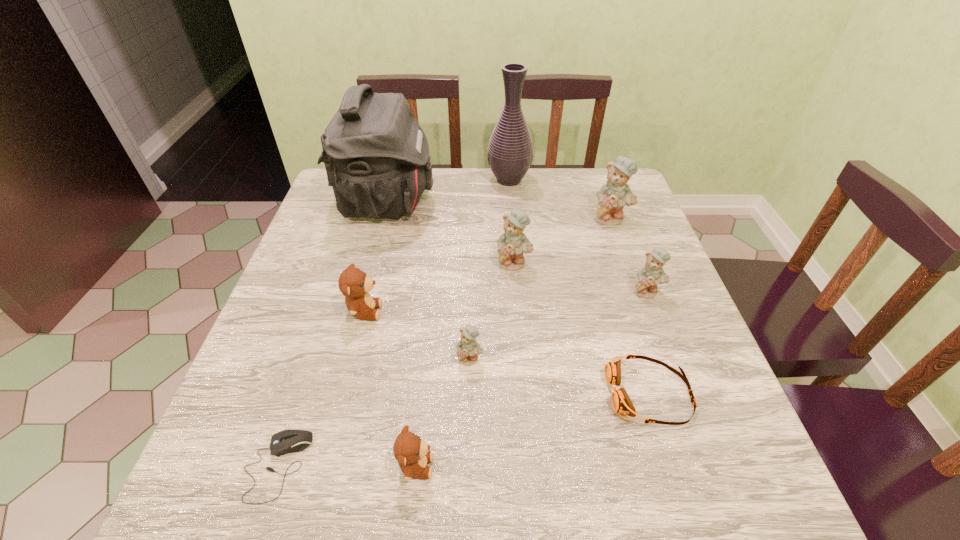
This screenshot has width=960, height=540. Identify the location of the nearest blue teddy bear. [468, 349].

Where is `the right brown teddy bear`? Image resolution: width=960 pixels, height=540 pixels. the right brown teddy bear is located at coordinates (411, 452).

Where is `the smaller brown teddy bear`? The height and width of the screenshot is (540, 960). the smaller brown teddy bear is located at coordinates (411, 452).

I want to click on goggles, so click(x=621, y=403).

The width and height of the screenshot is (960, 540). Identify the location of computer mouse. (287, 441).

The width and height of the screenshot is (960, 540). I want to click on vacant space located 0.400m on the left of the vase, so click(x=357, y=180).

This screenshot has height=540, width=960. Find the location of `free space located on the open flap of the gray shoulder bag`. free space located on the open flap of the gray shoulder bag is located at coordinates (469, 202).

This screenshot has width=960, height=540. In order to click on free space located on the front-facing side of the farthest blue teddy bear in this screenshot , I will do `click(633, 280)`.

Find the location of `vacant area located 0.390m on the front-facing side of the second biggest blue teddy bear`. vacant area located 0.390m on the front-facing side of the second biggest blue teddy bear is located at coordinates (527, 424).

At what (x,y) coordinates should I click in order to perform the action: click on free space located 0.340m on the face of the leftmost teddy bear. Please return your answer as a coordinate pair (x, y). Looking at the image, I should click on (537, 311).